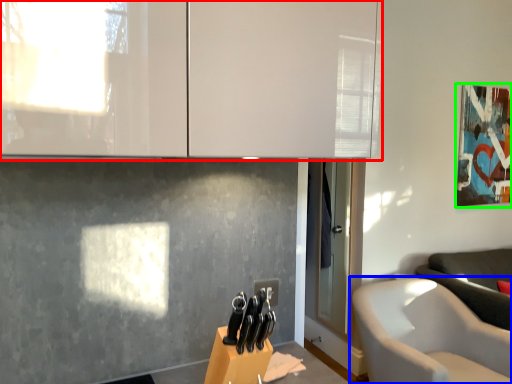
Question: Which object is the closest to the cabinetry (highlighted by a red box)? Choose among these: chair (highlighted by a blue box) or picture frame (highlighted by a green box).

Choices:
 (A) chair
 (B) picture frame

Answer: (A)